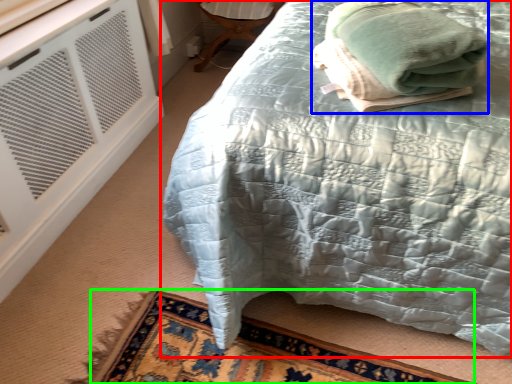
Question: Estimate the real-world distances between objects in this image. Which object is closer to bed (highlighted by a red box), bath towel (highlighted by a blue box) or mat (highlighted by a green box)?

Choices:
 (A) bath towel
 (B) mat

Answer: (A)